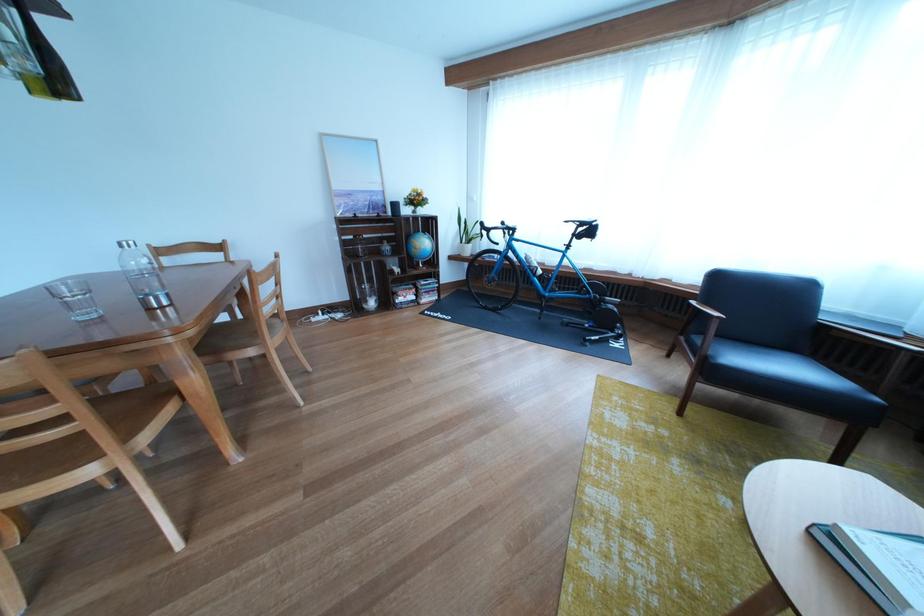
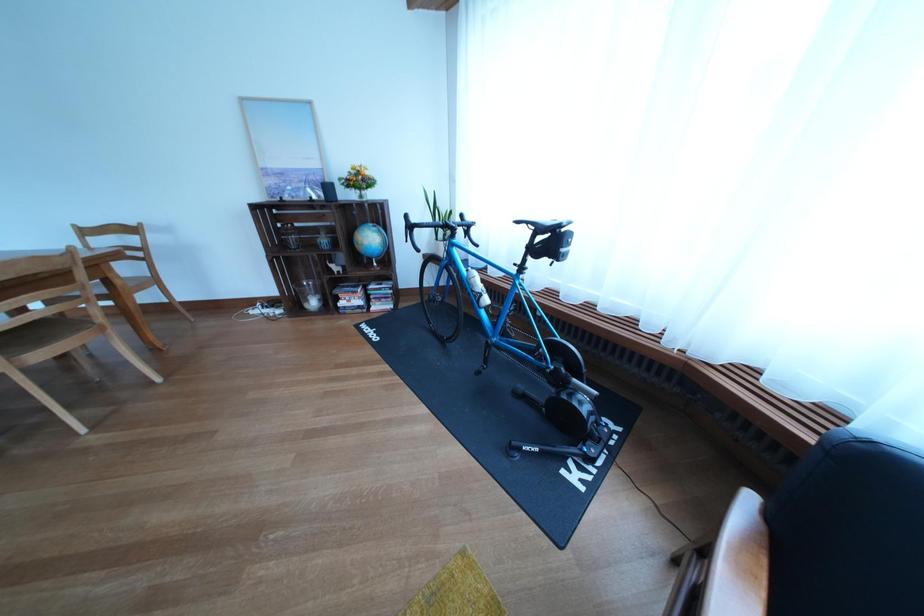
Locate, in the second image, the point that corresponds to point (438, 249) in the first image.

(383, 244)